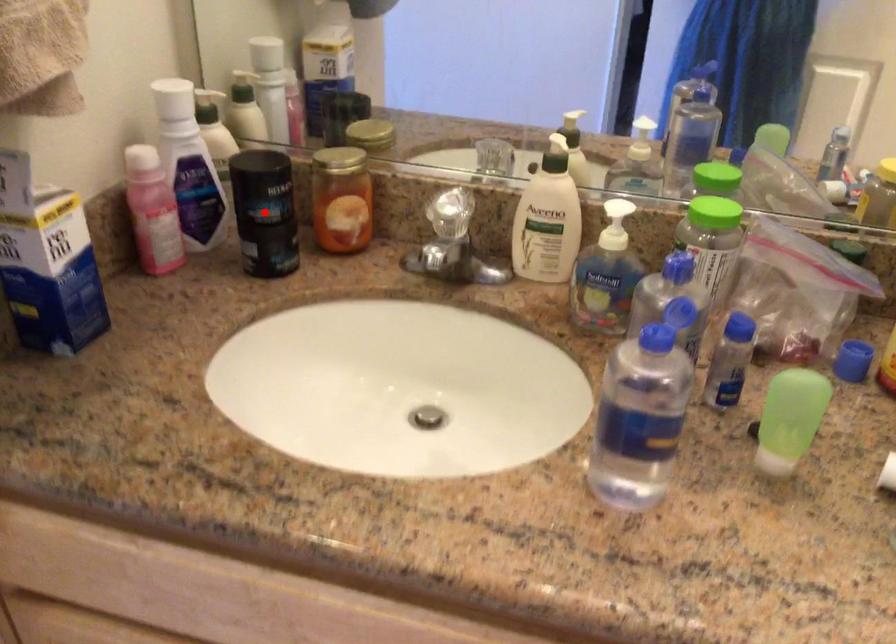
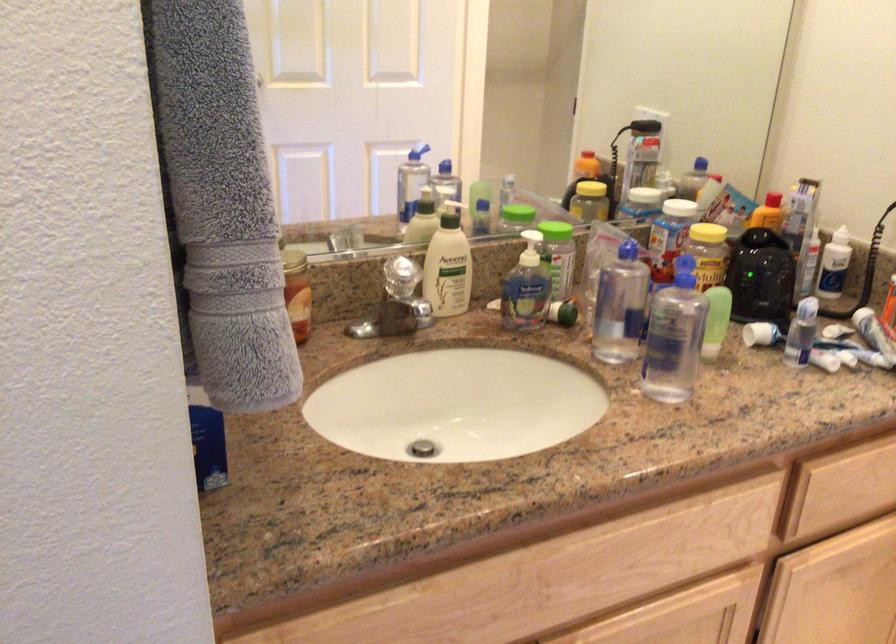
Question: I am providing you with two images of the same scene from different viewpoints. A red point is marked on the first image. Can you still see the location of the red point in image 2?

Choices:
 (A) Yes
 (B) No

Answer: (B)